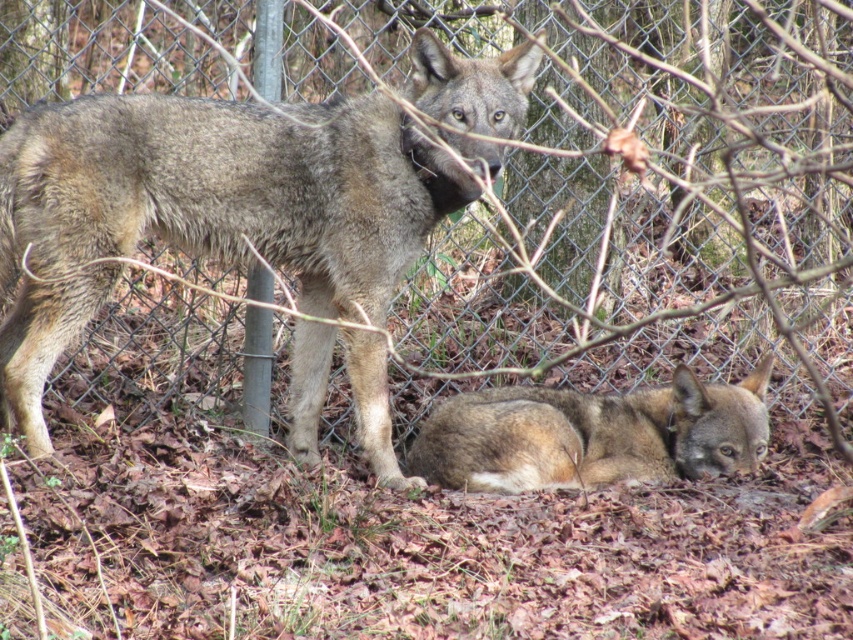
You are standing at the origin point of the coordinate system in the image. You want to locate the gray fur wolf at center. What are its coordinates?

The gray fur wolf at center is located at coordinates point (206,209).

You are a wildlife photographer trying to capture a photo of the gray fur wolf at center and the fuzzy brown fur at lower center. Since you want to ensure both subjects are in focus, you need to know which one is wider. Can you tell me which wolf is wider?

The gray fur wolf at center is wider than the fuzzy brown fur at lower center because its width surpasses the other.